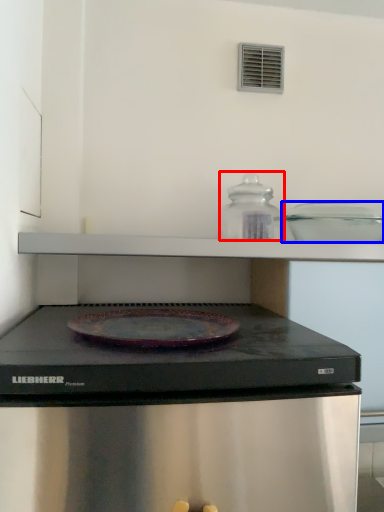
Question: Which point is closer to the camera, appliance (highlighted by a red box) or appliance (highlighted by a blue box)?

Choices:
 (A) appliance
 (B) appliance

Answer: (B)